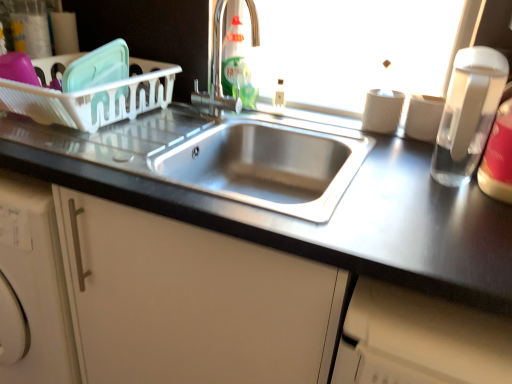
Question: Are satin nickel faucet at upper center and clear plastic bottle at right, which appears as the 3th bottle when viewed from the top, located far from each other?

Choices:
 (A) no
 (B) yes

Answer: (A)

Question: Does satin nickel faucet at upper center have a lesser height compared to clear plastic bottle at right, which ranks as the first bottle in front-to-back order?

Choices:
 (A) yes
 (B) no

Answer: (B)

Question: Does satin nickel faucet at upper center have a larger size compared to clear plastic bottle at right, which is the 3th bottle from back to front?

Choices:
 (A) yes
 (B) no

Answer: (A)

Question: From a real-world perspective, is satin nickel faucet at upper center located beneath clear plastic bottle at right, the first bottle viewed from the right?

Choices:
 (A) no
 (B) yes

Answer: (A)

Question: Considering the relative sizes of satin nickel faucet at upper center and clear plastic bottle at right, which is the 3th bottle from back to front, in the image provided, is satin nickel faucet at upper center thinner than clear plastic bottle at right, which is the 3th bottle from back to front,?

Choices:
 (A) yes
 (B) no

Answer: (A)

Question: From the image's perspective, is satin nickel faucet at upper center located above clear plastic bottle at right, which ranks as the first bottle in front-to-back order?

Choices:
 (A) yes
 (B) no

Answer: (A)

Question: Can you confirm if translucent plastic bottle at upper center, the 3th bottle from the right, is thinner than clear plastic bottle at right, the first bottle viewed from the right?

Choices:
 (A) no
 (B) yes

Answer: (B)

Question: From the image's perspective, does translucent plastic bottle at upper center, acting as the first bottle starting from the top, appear lower than clear plastic bottle at right, which ranks as the first bottle in front-to-back order?

Choices:
 (A) yes
 (B) no

Answer: (B)

Question: Is clear plastic bottle at right, which is counted as the 1th bottle, starting from the bottom, surrounded by translucent plastic bottle at upper center, the 2th bottle positioned from the back?

Choices:
 (A) yes
 (B) no

Answer: (B)

Question: Considering the relative positions of translucent plastic bottle at upper center, the 1th bottle positioned from the left, and clear plastic bottle at right, which is counted as the 1th bottle, starting from the bottom, in the image provided, is translucent plastic bottle at upper center, the 1th bottle positioned from the left, in front of clear plastic bottle at right, which is counted as the 1th bottle, starting from the bottom,?

Choices:
 (A) no
 (B) yes

Answer: (A)

Question: Considering the relative sizes of translucent plastic bottle at upper center, the 1th bottle positioned from the left, and clear plastic bottle at right, which is counted as the 1th bottle, starting from the bottom, in the image provided, is translucent plastic bottle at upper center, the 1th bottle positioned from the left, shorter than clear plastic bottle at right, which is counted as the 1th bottle, starting from the bottom,?

Choices:
 (A) no
 (B) yes

Answer: (A)

Question: Can you confirm if translucent plastic bottle at upper center, acting as the 2th bottle starting from the front, is bigger than clear plastic bottle at right, the 3th bottle viewed from the left?

Choices:
 (A) no
 (B) yes

Answer: (A)

Question: Is satin finish cabinet at center looking in the opposite direction of satin nickel faucet at upper center?

Choices:
 (A) yes
 (B) no

Answer: (B)